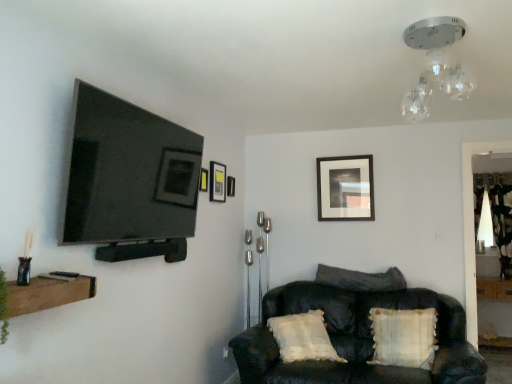
The width and height of the screenshot is (512, 384). What do you see at coordinates (404, 337) in the screenshot?
I see `white textured pillow at lower right, which appears as the 2th pillow when viewed from the top` at bounding box center [404, 337].

Describe the element at coordinates (128, 173) in the screenshot. I see `matte black tv at left` at that location.

Find the location of a particular element. dark brown leather couch at lower right is located at coordinates (356, 333).

Describe the element at coordinates (231, 186) in the screenshot. I see `matte black picture frame at upper center, which is the 2th picture frame in right-to-left order` at that location.

The image size is (512, 384). I want to click on white textured pillow at lower right, the first pillow when ordered from front to back, so click(404, 337).

Is white paper lampshade at upper right, the 2th light fixture in the top-to-bottom sequence, further to the viewer compared to white textured pillow at lower right, which appears as the 2th pillow when viewed from the top?

Yes, white paper lampshade at upper right, the 2th light fixture in the top-to-bottom sequence, is further from the camera.

Can you confirm if white paper lampshade at upper right, the 2th light fixture in the top-to-bottom sequence, is taller than white textured pillow at lower right, the second pillow when ordered from back to front?

Yes.

Is white paper lampshade at upper right, the 2th light fixture in the top-to-bottom sequence, oriented away from white textured pillow at lower right, the first pillow when ordered from front to back?

No, white paper lampshade at upper right, the 2th light fixture in the top-to-bottom sequence, is not facing the opposite direction of white textured pillow at lower right, the first pillow when ordered from front to back.

From the picture: How distant is white paper lampshade at upper right, marked as the first light fixture in a right-to-left arrangement, from white textured pillow at lower right, the second pillow when ordered from back to front?

2.85 meters.

Considering the positions of points (226, 346) and (217, 193), is point (226, 346) farther from camera compared to point (217, 193)?

That is True.

Is white plastic electric outlet at lower center closer to the viewer compared to matte black picture frame at upper center, arranged as the 2th picture frame when viewed from the left?

That is False.

Would you say white plastic electric outlet at lower center is inside or outside matte black picture frame at upper center, which is counted as the 3th picture frame, starting from the back?

The correct answer is: outside.

Can you confirm if white textured pillow at lower right, the first pillow when ordered from front to back, is wider than matte black picture frame at upper center, positioned as the 4th picture frame in front-to-back order?

Correct, the width of white textured pillow at lower right, the first pillow when ordered from front to back, exceeds that of matte black picture frame at upper center, positioned as the 4th picture frame in front-to-back order.

Considering the sizes of objects white textured pillow at lower right, the first pillow when ordered from front to back, and matte black picture frame at upper center, which is the fourth picture frame in left-to-right order, in the image provided, who is smaller, white textured pillow at lower right, the first pillow when ordered from front to back, or matte black picture frame at upper center, which is the fourth picture frame in left-to-right order,?

Smaller between the two is matte black picture frame at upper center, which is the fourth picture frame in left-to-right order.

Is white textured pillow at lower right, the second pillow when ordered from back to front, inside the boundaries of matte black picture frame at upper center, positioned as the 4th picture frame in front-to-back order, or outside?

white textured pillow at lower right, the second pillow when ordered from back to front, is located beyond the bounds of matte black picture frame at upper center, positioned as the 4th picture frame in front-to-back order.

From a real-world perspective, is clear glass light fixture at upper center, the second light fixture from the back, on matte black tv at left?

Yes, from a real-world perspective, clear glass light fixture at upper center, the second light fixture from the back, is above matte black tv at left.

This screenshot has height=384, width=512. What are the coordinates of `television below the clear glass light fixture at upper center, which ranks as the first light fixture in front-to-back order (from a real-world perspective)` in the screenshot? It's located at (128, 173).

Which of these two, clear glass light fixture at upper center, the 2th light fixture from the bottom, or matte black tv at left, is smaller?

With smaller size is clear glass light fixture at upper center, the 2th light fixture from the bottom.

Are white textured pillow at lower right, the first pillow from the bottom, and dark fabric pillow at center, which ranks as the 2th pillow in front-to-back order, making contact?

white textured pillow at lower right, the first pillow from the bottom, and dark fabric pillow at center, which ranks as the 2th pillow in front-to-back order, are not in contact.

Relative to dark fabric pillow at center, which ranks as the 2th pillow in front-to-back order, is white textured pillow at lower right, the first pillow from the bottom, in front or behind?

white textured pillow at lower right, the first pillow from the bottom, is positioned closer to the viewer than dark fabric pillow at center, which ranks as the 2th pillow in front-to-back order.

How different are the orientations of white textured pillow at lower right, the second pillow when ordered from back to front, and dark fabric pillow at center, which is the 1th pillow in back-to-front order, in degrees?

The facing directions of white textured pillow at lower right, the second pillow when ordered from back to front, and dark fabric pillow at center, which is the 1th pillow in back-to-front order, are 6.77 degrees apart.

Is dark fabric pillow at center, which ranks as the 2th pillow in front-to-back order, inside the boundaries of white paper lampshade at upper right, which is the 1th light fixture from bottom to top, or outside?

dark fabric pillow at center, which ranks as the 2th pillow in front-to-back order, exists outside the volume of white paper lampshade at upper right, which is the 1th light fixture from bottom to top.

From the picture: From a real-world perspective, is dark fabric pillow at center, the first pillow viewed from the top, on white paper lampshade at upper right, arranged as the 2th light fixture when viewed from the left?

No, from a real-world perspective, dark fabric pillow at center, the first pillow viewed from the top, is not on top of white paper lampshade at upper right, arranged as the 2th light fixture when viewed from the left.

Can you tell me how much dark fabric pillow at center, the first pillow viewed from the top, and white paper lampshade at upper right, the 2th light fixture in the top-to-bottom sequence, differ in facing direction?

dark fabric pillow at center, the first pillow viewed from the top, and white paper lampshade at upper right, the 2th light fixture in the top-to-bottom sequence, are facing 0.973 degrees away from each other.

Who is smaller, dark fabric pillow at center, which is the 1th pillow in back-to-front order, or white paper lampshade at upper right, arranged as the 2th light fixture when viewed from the front?

With smaller size is white paper lampshade at upper right, arranged as the 2th light fixture when viewed from the front.

Consider the image. From a real-world perspective, between white textured pillow at lower right, which appears as the 2th pillow when viewed from the top, and matte black picture frame at upper center, marked as the fourth picture frame in a back-to-front arrangement, who is vertically lower?

In real-world perspective, white textured pillow at lower right, which appears as the 2th pillow when viewed from the top, is lower.

From a real-world perspective, which pillow is the 2nd one underneath the matte black picture frame at upper center, the first picture frame from the left? Please provide its 2D coordinates.

[(404, 337)]

Is white textured pillow at lower right, the first pillow when ordered from front to back, placed right next to matte black picture frame at upper center, the 4th picture frame positioned from the right?

They are not placed beside each other.

Where is `light fixture located behind the white textured pillow at lower right, the first pillow when ordered from front to back`? This screenshot has width=512, height=384. light fixture located behind the white textured pillow at lower right, the first pillow when ordered from front to back is located at coordinates pyautogui.click(x=485, y=223).

Find the location of a particular element. the 1st picture frame to the left of the white plastic electric outlet at lower center, starting your count from the anchor is located at coordinates (217, 182).

Looking at this image, when comparing their distances from clear glass light fixture at upper center, the second light fixture from the back, does matte black picture frame at upper center, arranged as the second picture frame when viewed from the back, or matte black picture frame at upper center, placed as the 1th picture frame when sorted from back to front, seem closer?

Based on the image, matte black picture frame at upper center, placed as the 1th picture frame when sorted from back to front, appears to be nearer to clear glass light fixture at upper center, the second light fixture from the back.

Estimate the real-world distances between objects in this image. Which object is closer to matte black picture frame at upper center, which is counted as the 3th picture frame, starting from the back, matte black tv at left or matte black picture frame at upper center, placed as the 1th picture frame when sorted from back to front?

matte black tv at left.

Considering their positions, is matte black picture frame at upper center, acting as the third picture frame starting from the front, positioned closer to dark brown leather couch at lower right than matte black picture frame at upper center, the third picture frame from the right?

matte black picture frame at upper center, the third picture frame from the right.

From the image, which object appears to be farther from matte black tv at left, white plastic electric outlet at lower center or matte black picture frame at upper center, arranged as the second picture frame when viewed from the back?

white plastic electric outlet at lower center.

Considering their positions, is matte black picture frame at upper center, the third picture frame from the right, positioned closer to wooden shelf at lower left than matte black tv at left?

Based on the image, matte black tv at left appears to be nearer to wooden shelf at lower left.

Which object lies nearer to the anchor point white textured pillow at lower right, the first pillow from the bottom, floral fabric curtain at right or matte black picture frame at upper center, arranged as the 2th picture frame when viewed from the front?

matte black picture frame at upper center, arranged as the 2th picture frame when viewed from the front.

From the image, which object appears to be nearer to matte black picture frame at upper center, arranged as the second picture frame when viewed from the back, dark brown leather couch at lower right or white textured pillow at lower right, the first pillow when ordered from front to back?

The object closer to matte black picture frame at upper center, arranged as the second picture frame when viewed from the back, is dark brown leather couch at lower right.

Which object lies nearer to the anchor point white paper lampshade at upper right, arranged as the 2th light fixture when viewed from the front, clear glass light fixture at upper center, which is the second light fixture in right-to-left order, or white plastic electric outlet at lower center?

white plastic electric outlet at lower center.

I want to click on television between matte black picture frame at upper center, the first picture frame from the left, and dark brown leather couch at lower right from top to bottom, so click(x=128, y=173).

Where is `television between wooden shelf at lower left and white paper lampshade at upper right, the 1th light fixture in the back-to-front sequence, in the horizontal direction`? television between wooden shelf at lower left and white paper lampshade at upper right, the 1th light fixture in the back-to-front sequence, in the horizontal direction is located at coordinates (128, 173).

Identify the location of electric outlet between clear glass light fixture at upper center, the 1th light fixture in the top-to-bottom sequence, and matte black picture frame at upper center, placed as the 1th picture frame when sorted from back to front, in the front-back direction. (225, 352).

Locate an element on the screen. pillow between matte black picture frame at upper center, the 1th picture frame positioned from the front, and white textured pillow at lower right, the second pillow when ordered from back to front, from left to right is located at coordinates (361, 279).